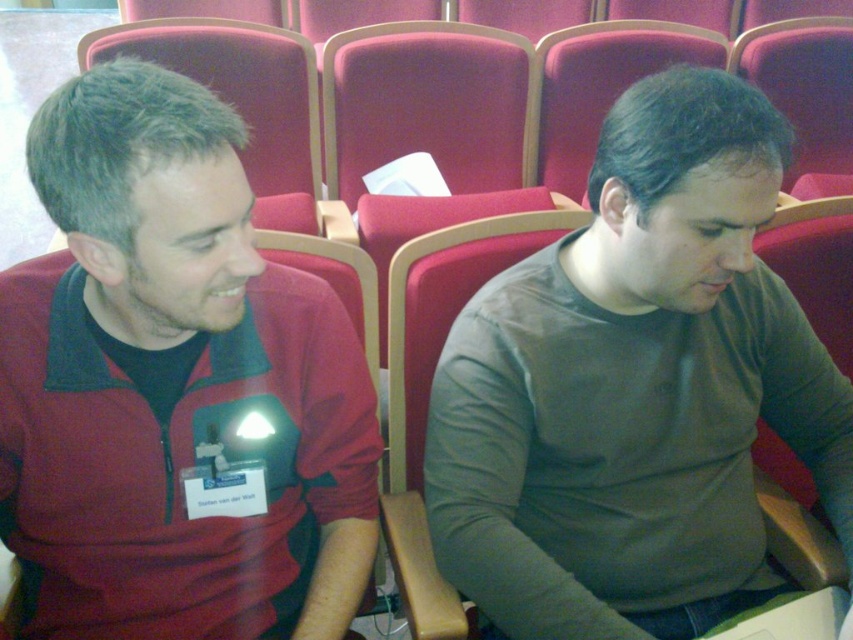
What do you see at coordinates (173, 388) in the screenshot?
I see `matte red jacket at left` at bounding box center [173, 388].

Is matte red jacket at left closer to camera compared to matte gray shirt at center?

Yes, it is.

This screenshot has height=640, width=853. Identify the location of matte red jacket at left. (173, 388).